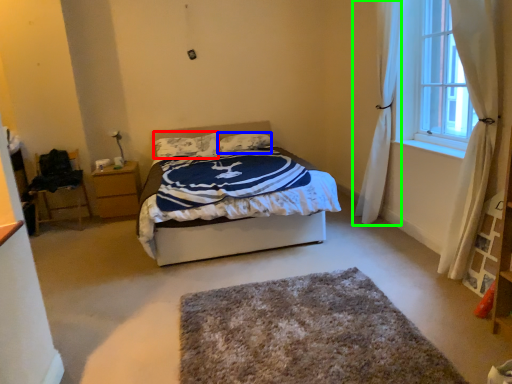
Question: Which object is the closest to the pillow (highlighted by a red box)? Choose among these: pillow (highlighted by a blue box) or curtain (highlighted by a green box).

Choices:
 (A) pillow
 (B) curtain

Answer: (A)